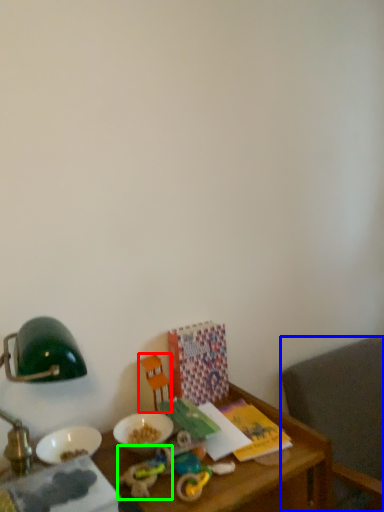
Question: Considering the real-world distances, which object is farthest from toy (highlighted by a red box)? chair (highlighted by a blue box) or toy (highlighted by a green box)?

Choices:
 (A) chair
 (B) toy

Answer: (A)